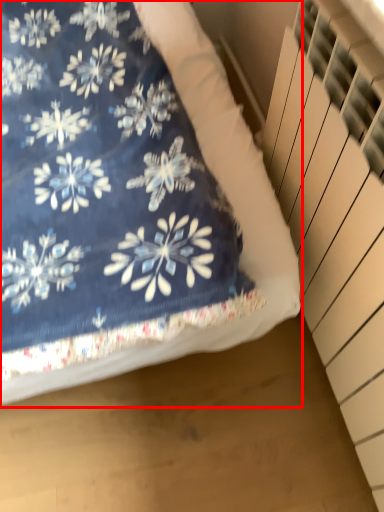
Question: Where is bed (annotated by the red box) located in relation to stairwell in the image?

Choices:
 (A) left
 (B) right

Answer: (A)